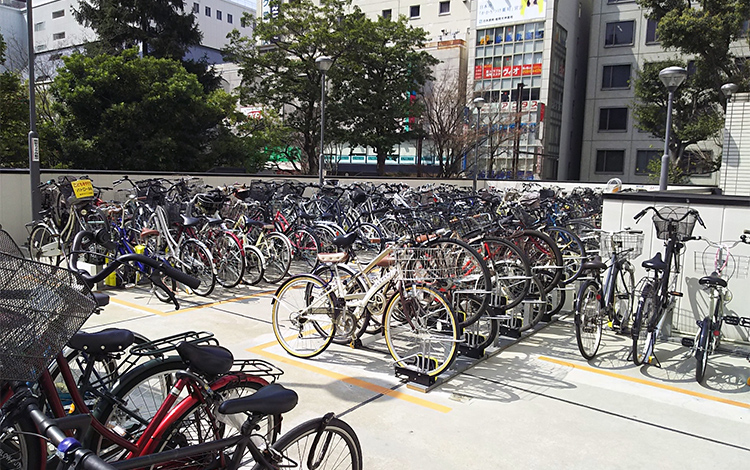
Locate an element on the screen. The image size is (750, 470). most right light is located at coordinates (674, 80).